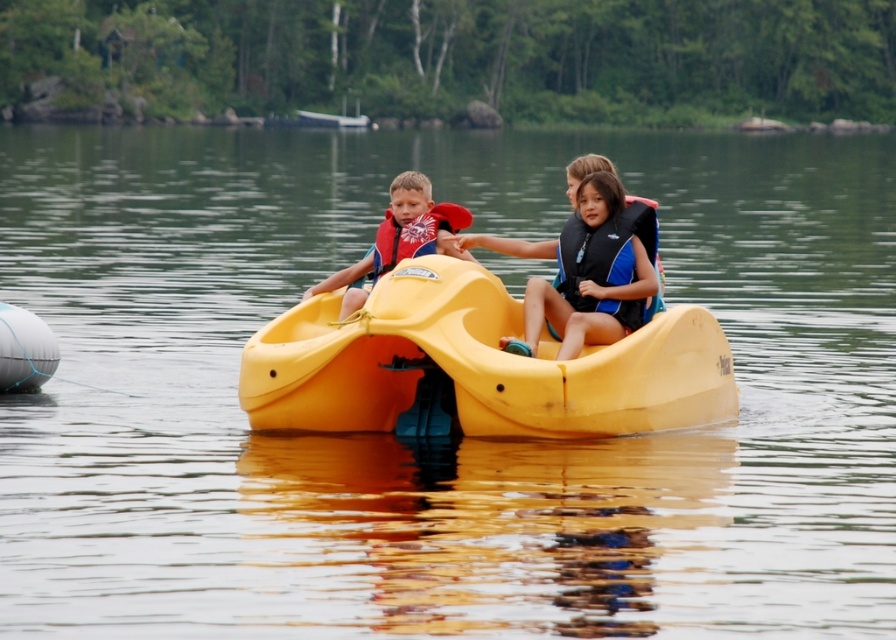
You are standing on the lakeside dock and want to throw a ball to a friend. You see two points in the water marked as point 1 at coordinates point (599, 301) and point 2 at coordinates point (433, 230). Which point is closer to you where you are standing on the dock?

Point (599, 301) is closer to the viewer than point (433, 230), so you should aim for point 1.

You are standing at the lakeside and see two points in the scene. Which point is closer to you, point (498, 246) or point (408, 225)?

Point (408, 225) is closer to you because it is less further than point (498, 246).